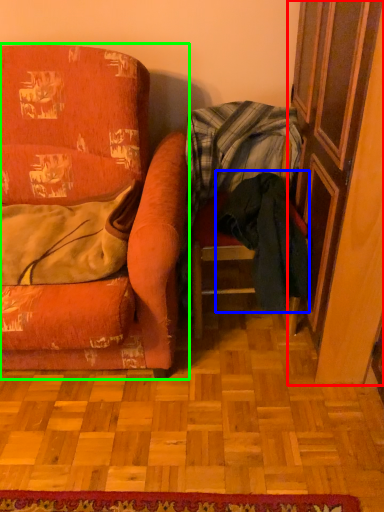
Question: Which object is positioned closest to screen door (highlighted by a red box)? Select from clothing (highlighted by a blue box) and chair (highlighted by a green box).

Choices:
 (A) clothing
 (B) chair

Answer: (A)